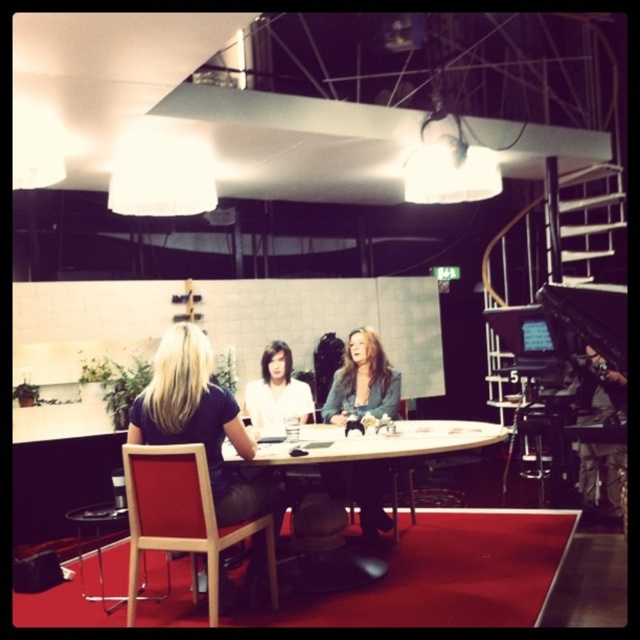
You are standing at the entrance of the room and want to sit down at the wooden round table at center. Is the wooden chair at lower left positioned in a way that you can easily sit at the table without moving the chair?

Yes, the wooden chair at lower left is positioned in front of the wooden round table at center, so it is likely in a suitable position for you to sit at the table without needing to move the chair.

You are standing at the entrance of the room and want to approach the two people seated at the table. Which of the two points, point (420, 435) or point (385, 397), should you walk towards to reach the person who is closer to the center of the table?

Point (420, 435) is in front of point (385, 397), so you should walk towards point (420, 435) to reach the person closer to the center of the table.

You are standing at the entrance of the room and want to sit down. There is a wooden chair at lower left marked by point (180, 518). Is this chair available for you to sit on?

The wooden chair at lower left marked by point (180, 518) is available for you to sit on since no one is occupying it.